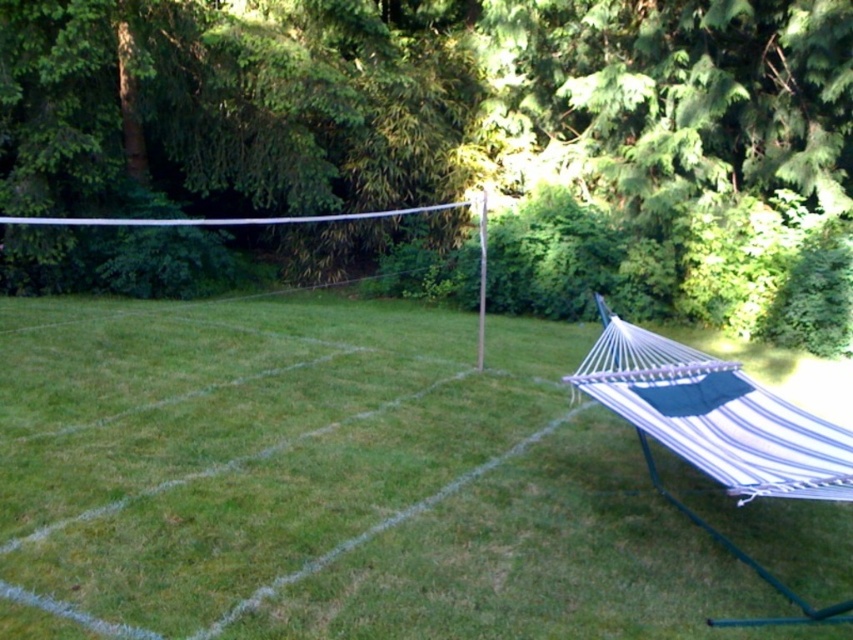
You are standing at the edge of the green grass at center and want to throw a frisbee to your friend who is standing at the opposite edge. How far apart are you and your friend?

The distance between you and your friend is 3.92 meters because the green grass at center has a length of 3.92 meters.

From the picture: You are standing in the backyard and want to take a photo of the green leafy tree at upper center. Which direction should you face to capture it in the frame?

The green leafy tree at upper center is located at point (421, 97) in the image, so you should face towards the upper center direction to capture it in the frame.